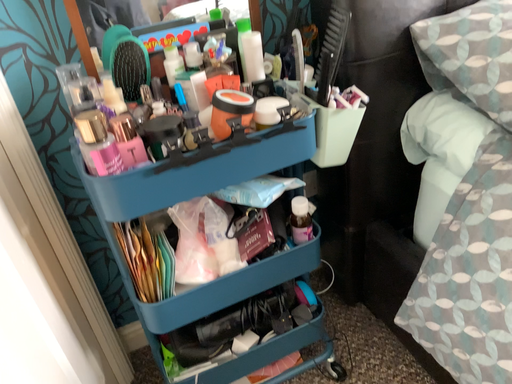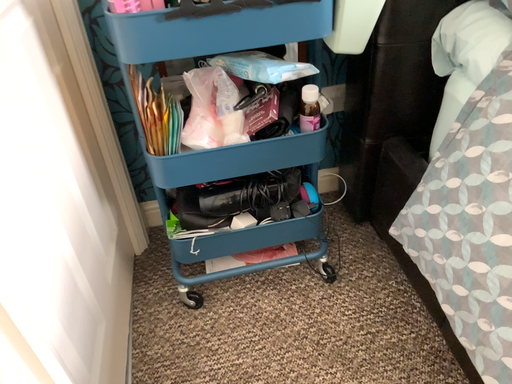
Question: Which way did the camera rotate in the video?

Choices:
 (A) rotated right
 (B) rotated left

Answer: (B)